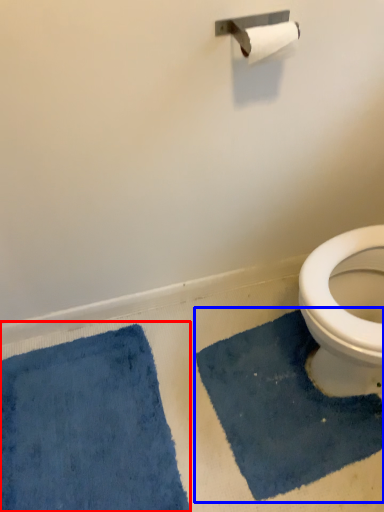
Question: Which object appears closest to the camera in this image, bath mat (highlighted by a red box) or bath mat (highlighted by a blue box)?

Choices:
 (A) bath mat
 (B) bath mat

Answer: (A)